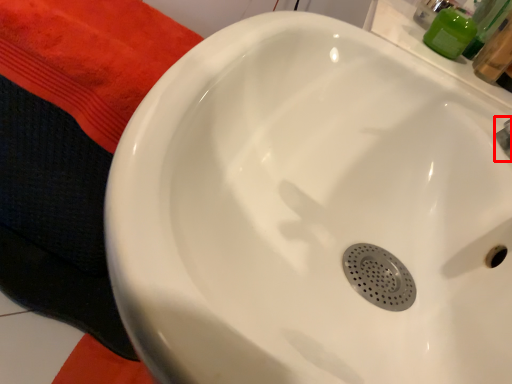
Question: In this image, where is plumbing fixture (annotated by the red box) located relative to toiletry?

Choices:
 (A) right
 (B) left

Answer: (A)